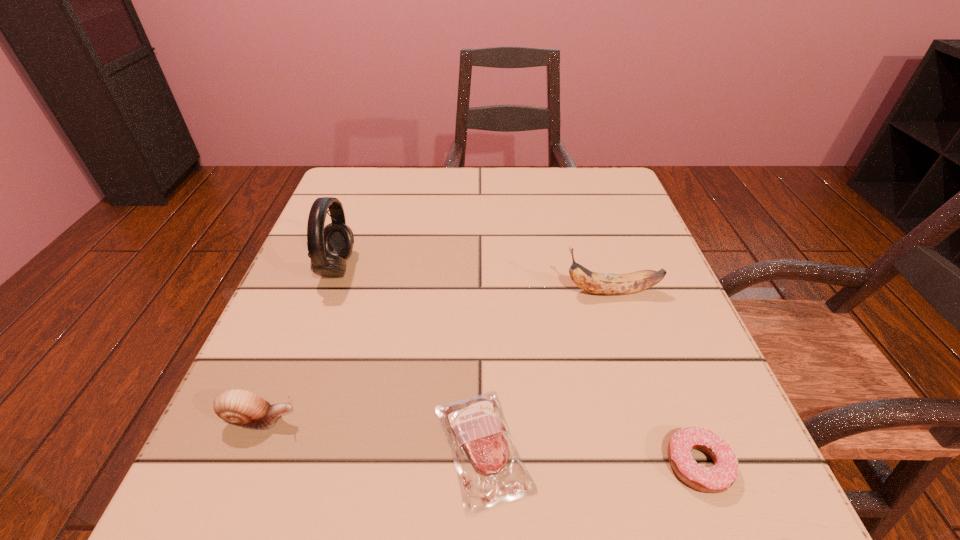
In the image, there is a desktop. Where is `vacant space at the far edge`? vacant space at the far edge is located at coordinates (414, 186).

Locate an element on the screen. The width and height of the screenshot is (960, 540). blank space at the near edge of the desktop is located at coordinates (508, 529).

In the image, there is a desktop. Identify the location of vacant space at the left edge. pyautogui.click(x=356, y=223).

Find the location of `free space at the right edge of the desktop`. free space at the right edge of the desktop is located at coordinates (684, 332).

Find the location of a particular element. The image size is (960, 540). vacant region at the far left corner of the desktop is located at coordinates (368, 168).

This screenshot has height=540, width=960. I want to click on free space between the doughnut and the banana, so click(x=655, y=378).

Where is `vacant point located between the third object from right to left and the escargot`? The width and height of the screenshot is (960, 540). vacant point located between the third object from right to left and the escargot is located at coordinates 372,434.

Identify the location of empty space between the third object from right to left and the banana. This screenshot has width=960, height=540. (547, 370).

This screenshot has height=540, width=960. Identify the location of blank region between the fourth tallest object and the headset. [x=517, y=366].

The width and height of the screenshot is (960, 540). In order to click on vacant area that lies between the headset and the fourth tallest object in this screenshot , I will do tap(517, 366).